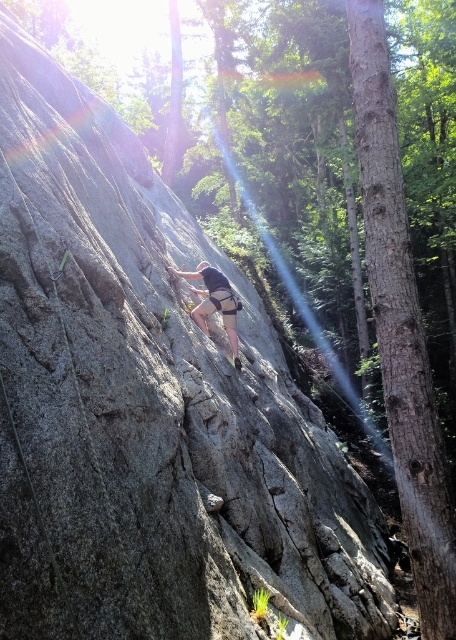
Is brown rough bark tree at right thinner than matte gray climbing harness at center?

Yes.

Who is higher up, brown rough bark tree at right or matte gray climbing harness at center?

Positioned higher is brown rough bark tree at right.

Find the location of a particular element. The height and width of the screenshot is (640, 456). brown rough bark tree at right is located at coordinates (400, 326).